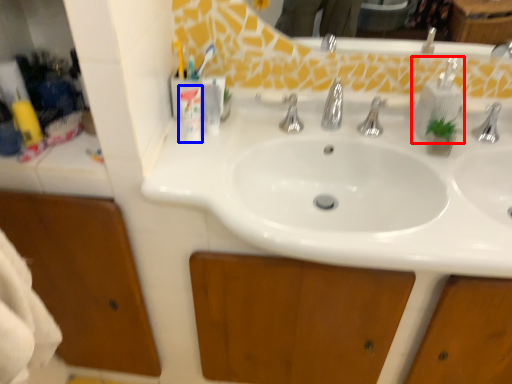
Question: Which of the following is the farthest to the observer, soap dispenser (highlighted by a red box) or toiletry (highlighted by a blue box)?

Choices:
 (A) soap dispenser
 (B) toiletry

Answer: (A)